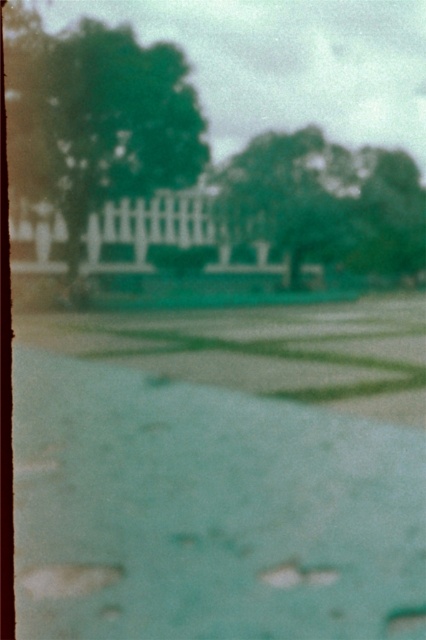
Question: Is green grass at center to the left of green leafy tree at upper left from the viewer's perspective?

Choices:
 (A) no
 (B) yes

Answer: (A)

Question: Can you confirm if green grass at center is thinner than green leafy tree at upper center?

Choices:
 (A) yes
 (B) no

Answer: (A)

Question: Among these objects, which one is nearest to the camera?

Choices:
 (A) green leafy tree at upper center
 (B) green grass at center

Answer: (B)

Question: Considering the real-world distances, which object is farthest from the green grass at center?

Choices:
 (A) green leafy tree at upper center
 (B) green leafy tree at upper left

Answer: (A)

Question: Among these points, which one is farthest from the camera?

Choices:
 (A) (140, 68)
 (B) (259, 157)
 (C) (83, 445)

Answer: (B)

Question: Is green grass at center positioned before green leafy tree at upper center?

Choices:
 (A) no
 (B) yes

Answer: (B)